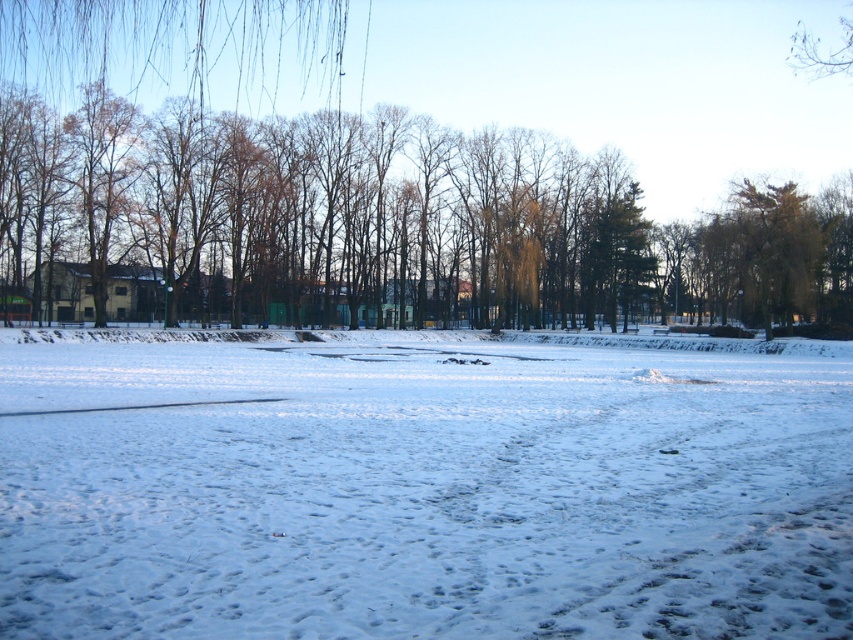
Does white powdery snow at center have a greater width compared to brown leafless tree at left?

No.

Describe the element at coordinates (421, 488) in the screenshot. I see `white powdery snow at center` at that location.

Where is `white powdery snow at center`? The image size is (853, 640). white powdery snow at center is located at coordinates (421, 488).